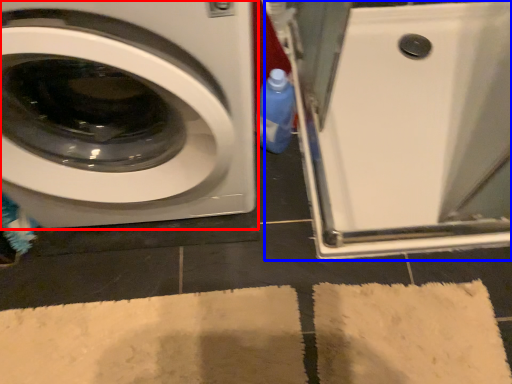
Question: Which point is further to the camera, washing machine (highlighted by a red box) or machine (highlighted by a blue box)?

Choices:
 (A) washing machine
 (B) machine

Answer: (B)